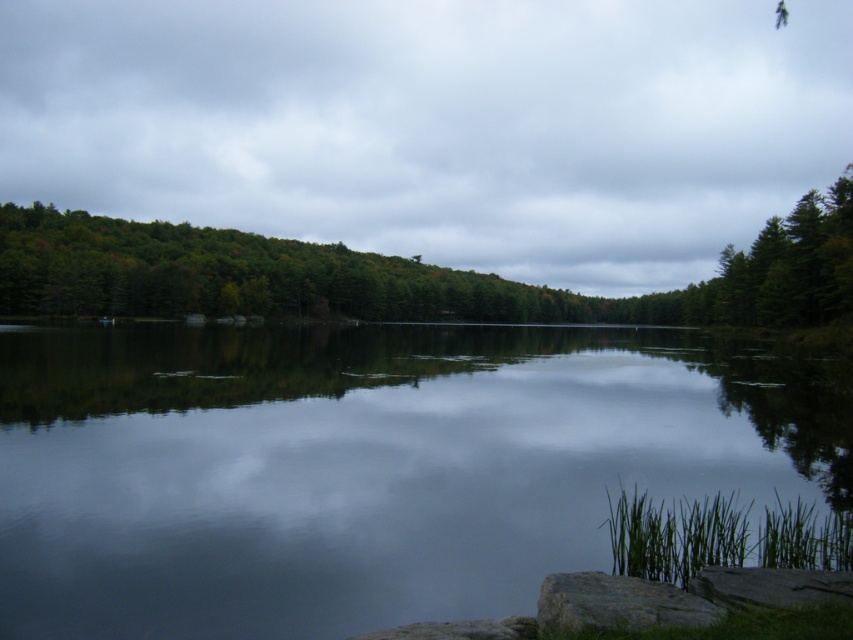
You are standing at the edge of the scene and want to take a photo that includes both the transparent water at center and the green matte tree at upper center. Which object will appear larger in your photo?

The green matte tree at upper center will appear larger in the photo because it is larger than the transparent water at center.

You are standing at the edge of the scene and want to walk from the transparent water at center to the green matte tree at upper center. Considering their widths, which object would require a narrower path?

The transparent water at center has a smaller width than the green matte tree at upper center, so the path to the transparent water at center would need to be narrower.